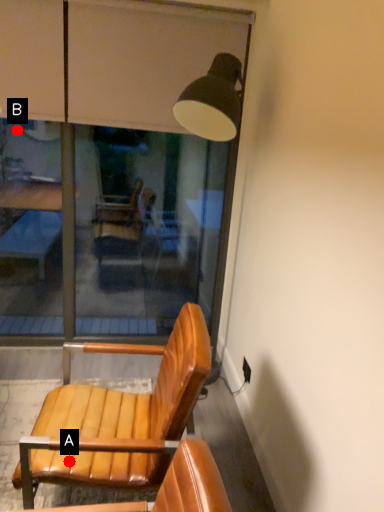
Question: Two points are circled on the image, labeled by A and B beside each circle. Among these points, which one is nearest to the camera?

Choices:
 (A) A is closer
 (B) B is closer

Answer: (A)